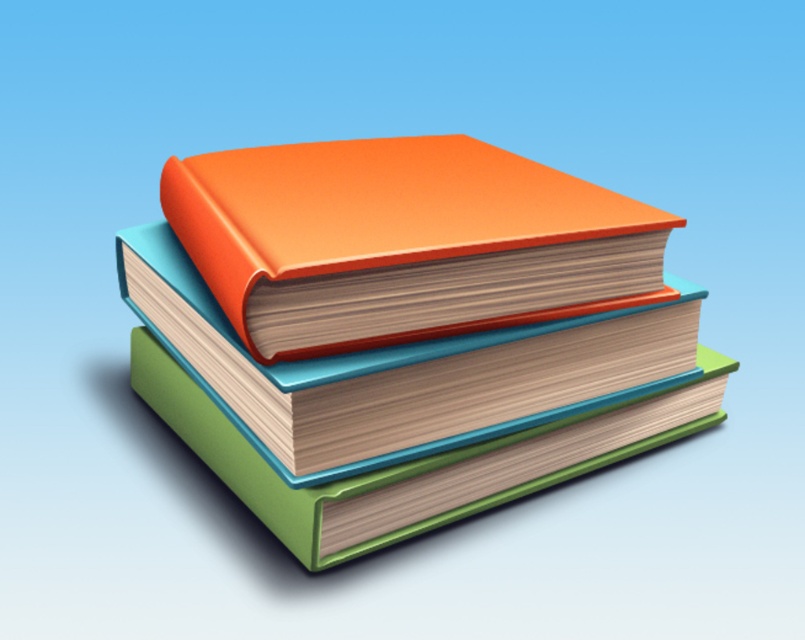
You are organizing books on a shelf and need to place both the orange matte book at center and the orange matte hardback book at center. If the shelf space is exactly the width of the wider book, which book should you place first to ensure they both fit?

The orange matte book at center is wider than the orange matte hardback book at center. Place the wider orange matte book at center first, then the narrower orange matte hardback book at center next to it to ensure they both fit on the shelf.

You are trying to organize these books on a shelf. The shelf has a height limit of 15 cm. The orange matte book at center is 12 cm tall, and the orange matte hardback book at center is 9 cm tall. If you want to place both books vertically on the shelf without exceeding the height limit, how should you arrange them?

To place both books vertically on the shelf without exceeding the height limit, you should stack the orange matte hardback book at center on top of the orange matte book at center. This way, the total height would be 12 cm plus 9 cm, totaling 21 cm, which exceeds the 15 cm limit. Wait, that doesn t work. Maybe place them side by side horizontally instead. Since the shelf height limit is 15 cm, placing them side by side would require their combined height to be under 15 cm. However, the tallest book is 12 cm

Is the orange matte book at center located to the left or right of the point at coordinates [407,328]?

The orange matte book at center is located exactly at the point marked by the coordinates [407,328], so it is neither to the left nor right of the point.